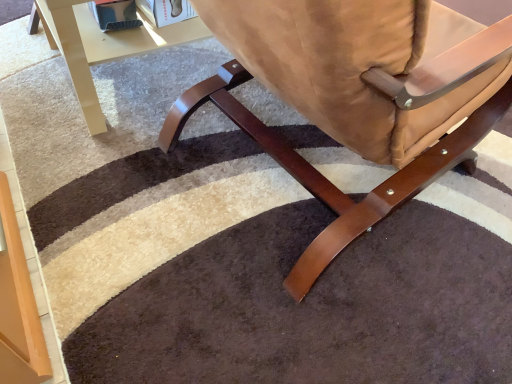
Find the location of a particular element. The image size is (512, 384). glossy beige table at upper left is located at coordinates (100, 45).

Image resolution: width=512 pixels, height=384 pixels. Describe the element at coordinates (100, 45) in the screenshot. I see `glossy beige table at upper left` at that location.

Describe the element at coordinates (328, 180) in the screenshot. This screenshot has height=384, width=512. I see `satin brown leather chair at center` at that location.

The image size is (512, 384). What are the coordinates of `satin brown leather chair at center` in the screenshot? It's located at (328, 180).

Where is `glossy beige table at upper left`? This screenshot has height=384, width=512. glossy beige table at upper left is located at coordinates (100, 45).

Which is more to the right, satin brown leather chair at center or glossy beige table at upper left?

From the viewer's perspective, satin brown leather chair at center appears more on the right side.

Which object is more forward, satin brown leather chair at center or glossy beige table at upper left?

satin brown leather chair at center.

Considering the points (490, 102) and (106, 51), which point is in front, point (490, 102) or point (106, 51)?

The point (490, 102) is closer.

From the image's perspective, would you say satin brown leather chair at center is shown under glossy beige table at upper left?

Yes, from the image's perspective, satin brown leather chair at center is beneath glossy beige table at upper left.

From a real-world perspective, relative to glossy beige table at upper left, is satin brown leather chair at center vertically above or below?

Clearly, from a real-world perspective, satin brown leather chair at center is above glossy beige table at upper left.

Looking at this image, considering the relative sizes of satin brown leather chair at center and glossy beige table at upper left in the image provided, is satin brown leather chair at center thinner than glossy beige table at upper left?

Incorrect, the width of satin brown leather chair at center is not less than that of glossy beige table at upper left.

Does satin brown leather chair at center have a lesser height compared to glossy beige table at upper left?

Incorrect, the height of satin brown leather chair at center does not fall short of that of glossy beige table at upper left.

Can you confirm if satin brown leather chair at center is bigger than glossy beige table at upper left?

Correct, satin brown leather chair at center is larger in size than glossy beige table at upper left.

Is glossy beige table at upper left surrounded by satin brown leather chair at center?

No, glossy beige table at upper left is not a part of satin brown leather chair at center.

Is satin brown leather chair at center far from glossy beige table at upper left?

Actually, satin brown leather chair at center and glossy beige table at upper left are a little close together.

Is satin brown leather chair at center oriented towards glossy beige table at upper left?

No.

How different are the orientations of satin brown leather chair at center and glossy beige table at upper left in degrees?

The angle between the facing direction of satin brown leather chair at center and the facing direction of glossy beige table at upper left is 9.83 degrees.

Measure the distance from satin brown leather chair at center to glossy beige table at upper left.

A distance of 17.97 inches exists between satin brown leather chair at center and glossy beige table at upper left.

The height and width of the screenshot is (384, 512). Find the location of `table that appears behind the satin brown leather chair at center`. table that appears behind the satin brown leather chair at center is located at coordinates (100, 45).

Which object is positioned more to the left, glossy beige table at upper left or satin brown leather chair at center?

glossy beige table at upper left is more to the left.

Is the position of glossy beige table at upper left more distant than that of satin brown leather chair at center?

Yes, glossy beige table at upper left is further from the viewer.

Which is closer, (110, 57) or (317, 251)?

Point (317, 251)

From the image's perspective, is glossy beige table at upper left above or below satin brown leather chair at center?

Based on their image positions, glossy beige table at upper left is located above satin brown leather chair at center.

From a real-world perspective, is glossy beige table at upper left over satin brown leather chair at center?

Actually, glossy beige table at upper left is physically below satin brown leather chair at center in the real world.

Which of these two, glossy beige table at upper left or satin brown leather chair at center, is thinner?

With smaller width is glossy beige table at upper left.

From their relative heights in the image, would you say glossy beige table at upper left is taller or shorter than satin brown leather chair at center?

In the image, glossy beige table at upper left appears to be shorter than satin brown leather chair at center.

Considering the sizes of objects glossy beige table at upper left and satin brown leather chair at center in the image provided, who is smaller, glossy beige table at upper left or satin brown leather chair at center?

With smaller size is glossy beige table at upper left.

Is satin brown leather chair at center completely or partially inside glossy beige table at upper left?

No, satin brown leather chair at center is not surrounded by glossy beige table at upper left.

Is glossy beige table at upper left not near satin brown leather chair at center?

No, glossy beige table at upper left is not far away from satin brown leather chair at center.

Is glossy beige table at upper left facing away from satin brown leather chair at center?

No.

Where is `chair above the glossy beige table at upper left (from a real-world perspective)`? The image size is (512, 384). chair above the glossy beige table at upper left (from a real-world perspective) is located at coordinates (328, 180).

What are the coordinates of `table on the left of satin brown leather chair at center` in the screenshot? It's located at (100, 45).

Find the location of a particular element. This screenshot has width=512, height=384. table that appears above the satin brown leather chair at center (from the image's perspective) is located at coordinates (100, 45).